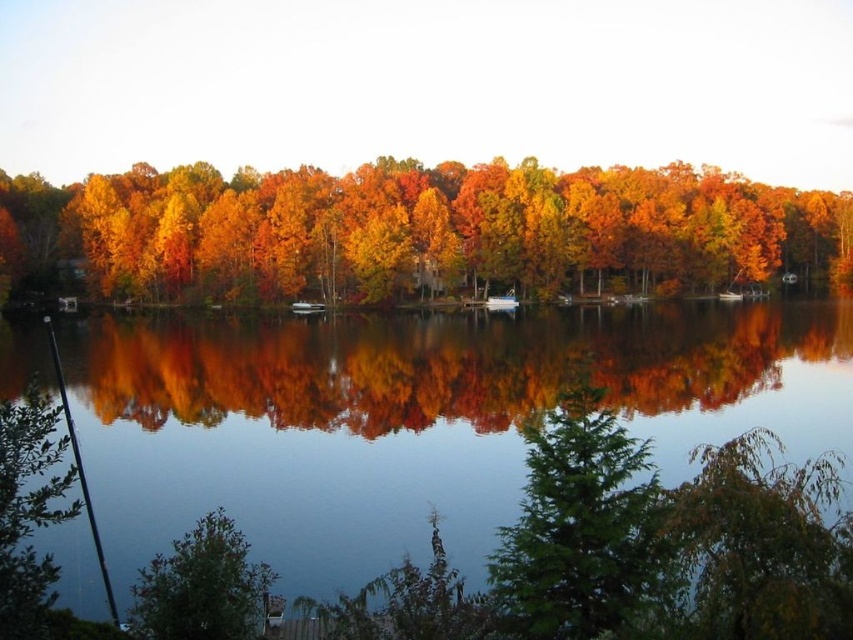
Who is taller, green matte tree at lower right or white glossy boat at center?

Standing taller between the two is green matte tree at lower right.

Is green matte tree at lower right to the left of white glossy boat at center from the viewer's perspective?

In fact, green matte tree at lower right is to the right of white glossy boat at center.

Measure the distance between point (689, 604) and camera.

They are 28.55 feet apart.

The image size is (853, 640). I want to click on green matte tree at lower right, so (759, 545).

Can you confirm if transparent water at center is positioned to the left of autumn leaves at center?

Correct, you'll find transparent water at center to the left of autumn leaves at center.

Who is positioned more to the left, transparent water at center or autumn leaves at center?

transparent water at center

Does point (730, 413) lie in front of point (100, 268)?

Yes, it is.

Locate an element on the screen. This screenshot has height=640, width=853. transparent water at center is located at coordinates (413, 417).

Is autumn leaves at center positioned in front of green matte tree at lower right?

No, autumn leaves at center is further to the viewer.

The height and width of the screenshot is (640, 853). I want to click on autumn leaves at center, so click(418, 230).

Locate an element on the screen. The image size is (853, 640). autumn leaves at center is located at coordinates (418, 230).